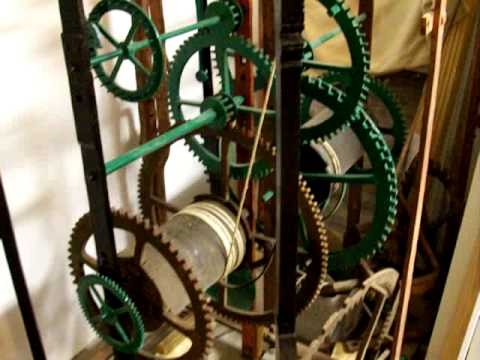
The height and width of the screenshot is (360, 480). I want to click on floor, so click(x=93, y=354).